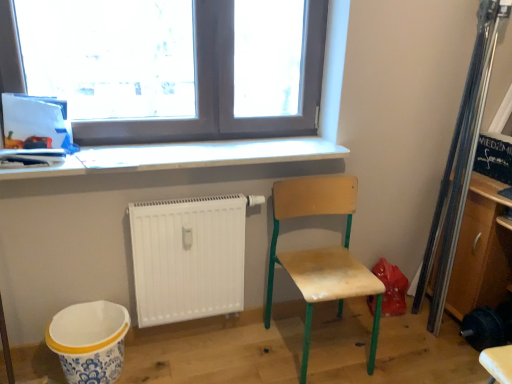
Question: Can you see white matte radiator at lower center touching wooden chair at lower right?

Choices:
 (A) no
 (B) yes

Answer: (A)

Question: From the image's perspective, is white matte radiator at lower center over wooden chair at lower right?

Choices:
 (A) yes
 (B) no

Answer: (A)

Question: Does white matte radiator at lower center appear on the right side of wooden chair at lower right?

Choices:
 (A) no
 (B) yes

Answer: (A)

Question: Is white matte radiator at lower center far from wooden chair at lower right?

Choices:
 (A) no
 (B) yes

Answer: (A)

Question: Can you confirm if white matte radiator at lower center is positioned to the left of wooden chair at lower right?

Choices:
 (A) yes
 (B) no

Answer: (A)

Question: From a real-world perspective, is white matte radiator at lower center over wooden chair at lower right?

Choices:
 (A) yes
 (B) no

Answer: (A)

Question: Can you confirm if white glossy counter top at upper center is taller than wooden chair at lower right?

Choices:
 (A) no
 (B) yes

Answer: (A)

Question: From the image's perspective, does white glossy counter top at upper center appear higher than wooden chair at lower right?

Choices:
 (A) yes
 (B) no

Answer: (A)

Question: Can you confirm if white glossy counter top at upper center is smaller than wooden chair at lower right?

Choices:
 (A) yes
 (B) no

Answer: (A)

Question: Is wooden chair at lower right at the back of white glossy counter top at upper center?

Choices:
 (A) no
 (B) yes

Answer: (A)

Question: Is white glossy counter top at upper center next to wooden chair at lower right and touching it?

Choices:
 (A) no
 (B) yes

Answer: (A)

Question: Is white glossy counter top at upper center thinner than wooden chair at lower right?

Choices:
 (A) no
 (B) yes

Answer: (B)

Question: Is white matte radiator at lower center positioned with its back to white ceramic mixing bowl at lower left?

Choices:
 (A) yes
 (B) no

Answer: (B)